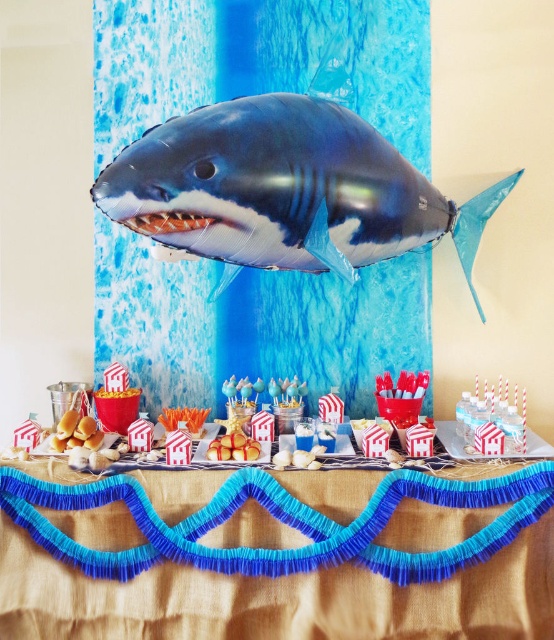
Question: Which point appears farthest from the camera in this image?

Choices:
 (A) (134, 182)
 (B) (418, 444)
 (C) (547, 608)

Answer: (B)

Question: Does shiny metallic shark at upper center have a smaller size compared to white paper houses at center?

Choices:
 (A) no
 (B) yes

Answer: (A)

Question: Estimate the real-world distances between objects in this image. Which object is farther from the blue paper garland at center?

Choices:
 (A) white paper houses at center
 (B) shiny metallic shark at upper center

Answer: (B)

Question: Among these points, which one is farthest from the camera?

Choices:
 (A) (326, 476)
 (B) (202, 188)
 (C) (233, 460)

Answer: (C)

Question: Is blue paper garland at center thinner than white paper houses at center?

Choices:
 (A) yes
 (B) no

Answer: (A)

Question: Considering the relative positions of blue paper garland at center and shiny metallic shark at upper center in the image provided, where is blue paper garland at center located with respect to shiny metallic shark at upper center?

Choices:
 (A) left
 (B) right

Answer: (A)